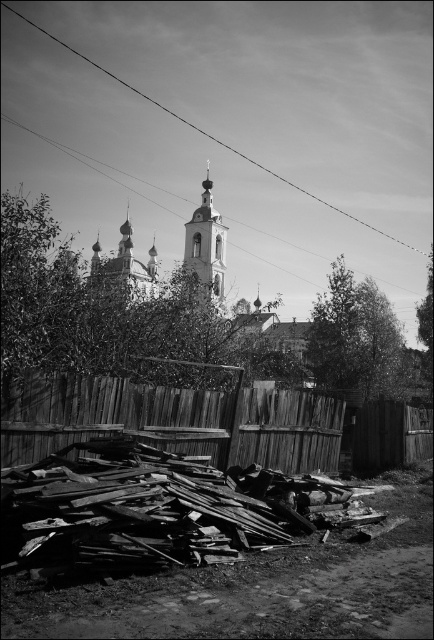
Question: Does wooden fence at lower center have a larger size compared to metallic wire at upper center?

Choices:
 (A) yes
 (B) no

Answer: (B)

Question: Is rusty wood debris at lower center positioned behind smooth stone tower at center?

Choices:
 (A) yes
 (B) no

Answer: (B)

Question: Based on their relative distances, which object is farther from the rusty wood debris at lower center?

Choices:
 (A) smooth stone tower at center
 (B) metallic wire at upper center

Answer: (B)

Question: Which of these objects is positioned farthest from the rusty wood debris at lower center?

Choices:
 (A) metallic wire at upper center
 (B) smooth stone tower at center
 (C) wooden fence at lower center

Answer: (A)

Question: Can you confirm if wooden fence at lower center is positioned above metallic wire at upper center?

Choices:
 (A) no
 (B) yes

Answer: (A)

Question: Which object is positioned farthest from the rusty wood debris at lower center?

Choices:
 (A) metallic wire at upper center
 (B) wooden fence at lower center

Answer: (A)